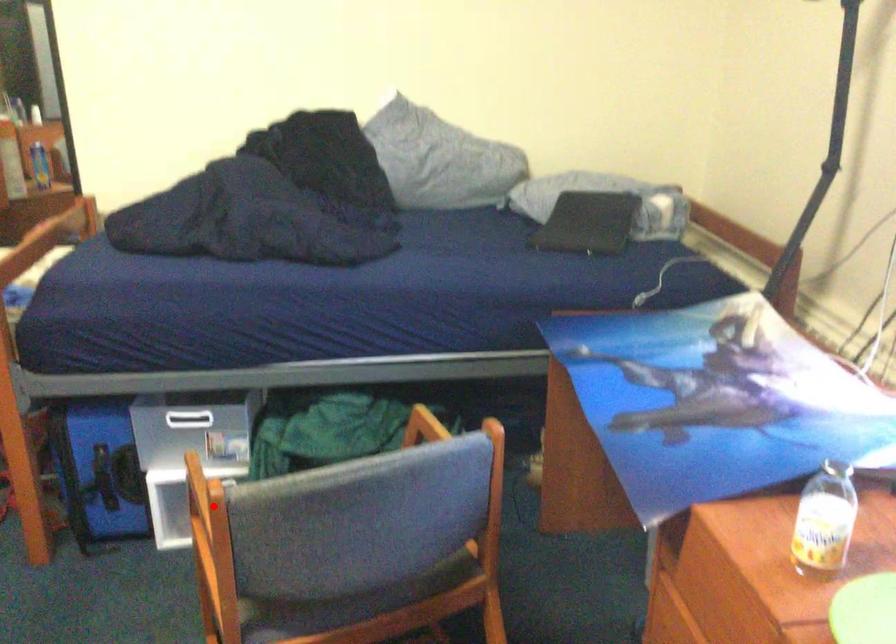
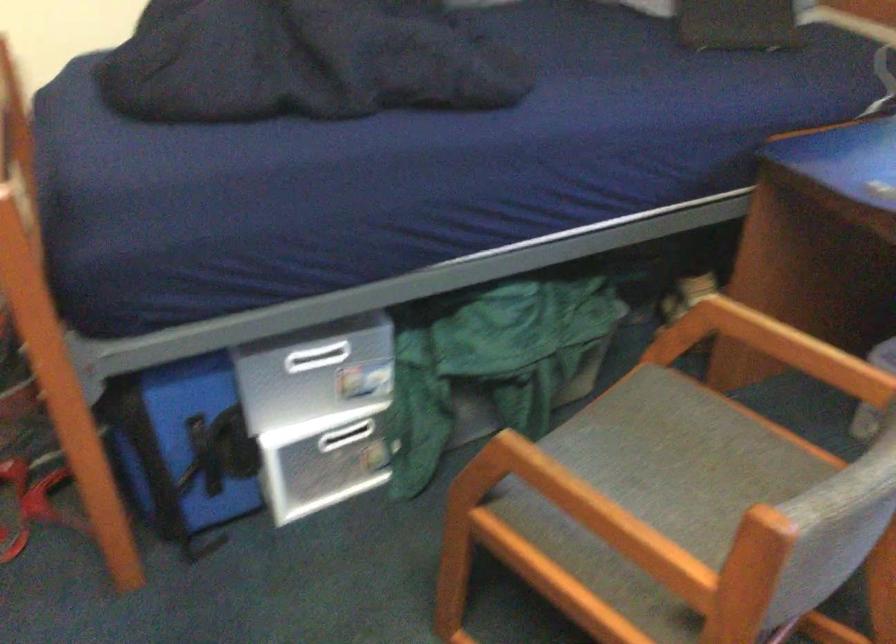
In the second image, find the point that corresponds to the highlighted location in the first image.

(597, 514)